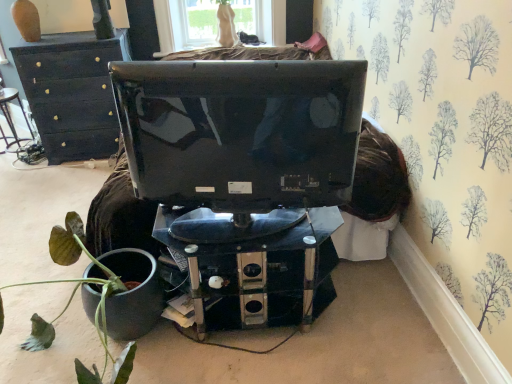
What do you see at coordinates (256, 265) in the screenshot?
I see `metallic black computer desk at center` at bounding box center [256, 265].

Describe the element at coordinates (11, 119) in the screenshot. This screenshot has width=512, height=384. I see `metallic silver chair at left` at that location.

I want to click on green matte plant pot at lower left, so click(x=89, y=287).

This screenshot has width=512, height=384. In order to click on black wood dresser at upper left in this screenshot , I will do `click(72, 92)`.

At what (x,y) coordinates should I click in order to perform the action: click on glossy black monitor at center. Please return your answer as a coordinate pair (x, y). Looking at the image, I should click on (241, 132).

Is glossy black monitor at center outside of transparent glass window at upper center?

That's correct, glossy black monitor at center is outside of transparent glass window at upper center.

From the image's perspective, does glossy black monitor at center appear higher than transparent glass window at upper center?

No, from the image's perspective, glossy black monitor at center is not over transparent glass window at upper center.

You are a GUI agent. You are given a task and a screenshot of the screen. Output one action in this format:
    pyautogui.click(x=<x>, y=<y>)
    Task: Click on the computer monitor located below the transparent glass window at upper center (from the image's perspective)
    
    Given the screenshot: What is the action you would take?
    pyautogui.click(x=241, y=132)

Could you tell me if glossy black monitor at center is turned towards transparent glass window at upper center?

Yes, glossy black monitor at center is oriented towards transparent glass window at upper center.

From a real-world perspective, who is located higher, metallic silver chair at left or black wood dresser at upper left?

black wood dresser at upper left is physically above.

You are a GUI agent. You are given a task and a screenshot of the screen. Output one action in this format:
    pyautogui.click(x=<x>, y=<y>)
    Task: Click on the furniture that appears above the metallic silver chair at left (from the image's perspective)
    The width and height of the screenshot is (512, 384).
    Given the screenshot: What is the action you would take?
    pyautogui.click(x=72, y=92)

Which object is wider, metallic silver chair at left or black wood dresser at upper left?

black wood dresser at upper left is wider.

Does metallic silver chair at left have a smaller size compared to black wood dresser at upper left?

Indeed, metallic silver chair at left has a smaller size compared to black wood dresser at upper left.

Considering the relative sizes of black wood dresser at upper left and transparent glass window at upper center in the image provided, is black wood dresser at upper left taller than transparent glass window at upper center?

Indeed, black wood dresser at upper left has a greater height compared to transparent glass window at upper center.

Which of these two, black wood dresser at upper left or transparent glass window at upper center, is wider?

Wider between the two is black wood dresser at upper left.

How different are the orientations of black wood dresser at upper left and transparent glass window at upper center in degrees?

The angle between the facing direction of black wood dresser at upper left and the facing direction of transparent glass window at upper center is 0.709 degrees.

Visually, is black wood dresser at upper left positioned to the left or to the right of transparent glass window at upper center?

black wood dresser at upper left is positioned on transparent glass window at upper center's left side.

Does green matte plant pot at lower left come behind metallic black computer desk at center?

No, green matte plant pot at lower left is in front of metallic black computer desk at center.

Based on the photo, from the image's perspective, would you say green matte plant pot at lower left is positioned over metallic black computer desk at center?

No, from the image's perspective, green matte plant pot at lower left is not over metallic black computer desk at center.

Looking at this image, what's the angular difference between green matte plant pot at lower left and metallic black computer desk at center's facing directions?

They differ by 1.31e-05 degrees in their facing directions.

Is point (149, 273) closer or farther from the camera than point (218, 222)?

Clearly, point (149, 273) is more distant from the camera than point (218, 222).

Considering the relative positions of metallic silver chair at left and metallic black computer desk at center in the image provided, is metallic silver chair at left to the left or to the right of metallic black computer desk at center?

metallic silver chair at left is to the left of metallic black computer desk at center.

Where is `computer desk on the right of metallic silver chair at left`? The height and width of the screenshot is (384, 512). computer desk on the right of metallic silver chair at left is located at coordinates (256, 265).

Is metallic silver chair at left taller than metallic black computer desk at center?

Yes.

Does transparent glass window at upper center contain glossy black monitor at center?

No, glossy black monitor at center is not inside transparent glass window at upper center.

Relative to glossy black monitor at center, is transparent glass window at upper center in front or behind?

transparent glass window at upper center is behind glossy black monitor at center.

Considering the relative sizes of transparent glass window at upper center and glossy black monitor at center in the image provided, is transparent glass window at upper center thinner than glossy black monitor at center?

No, transparent glass window at upper center is not thinner than glossy black monitor at center.

Between transparent glass window at upper center and glossy black monitor at center, which one has larger size?

glossy black monitor at center is bigger.

Is green matte plant pot at lower left oriented towards black wood dresser at upper left?

No, green matte plant pot at lower left does not turn towards black wood dresser at upper left.

From a real-world perspective, which object stands above the other?

black wood dresser at upper left, from a real-world perspective.

How many degrees apart are the facing directions of green matte plant pot at lower left and black wood dresser at upper left?

They differ by 4.02e-05 degrees in their facing directions.

From their relative heights in the image, would you say green matte plant pot at lower left is taller or shorter than black wood dresser at upper left?

Clearly, green matte plant pot at lower left is shorter compared to black wood dresser at upper left.

What are the coordinates of `computer monitor that is on the right side of transparent glass window at upper center` in the screenshot? It's located at (241, 132).

Locate an element on the screen. chair below the black wood dresser at upper left (from a real-world perspective) is located at coordinates (11, 119).

Estimate the real-world distances between objects in this image. Which object is closer to glossy black monitor at center, metallic black computer desk at center or transparent glass window at upper center?

Among the two, metallic black computer desk at center is located nearer to glossy black monitor at center.

From the image, which object appears to be farther from metallic silver chair at left, metallic black computer desk at center or transparent glass window at upper center?

metallic black computer desk at center is positioned further to the anchor metallic silver chair at left.

From the image, which object appears to be farther from metallic black computer desk at center, metallic silver chair at left or black wood dresser at upper left?

The object further to metallic black computer desk at center is metallic silver chair at left.

Estimate the real-world distances between objects in this image. Which object is closer to transparent glass window at upper center, metallic black computer desk at center or glossy black monitor at center?

glossy black monitor at center is closer to transparent glass window at upper center.

From the image, which object appears to be farther from glossy black monitor at center, black wood dresser at upper left or metallic silver chair at left?

The object further to glossy black monitor at center is metallic silver chair at left.

Based on the photo, estimate the real-world distances between objects in this image. Which object is closer to green matte plant pot at lower left, transparent glass window at upper center or metallic silver chair at left?

Based on the image, metallic silver chair at left appears to be nearer to green matte plant pot at lower left.

Considering their positions, is green matte plant pot at lower left positioned further to transparent glass window at upper center than black wood dresser at upper left?

green matte plant pot at lower left lies further to transparent glass window at upper center than the other object.

From the image, which object appears to be farther from black wood dresser at upper left, metallic silver chair at left or green matte plant pot at lower left?

green matte plant pot at lower left is further to black wood dresser at upper left.

Locate an element on the screen. computer desk between green matte plant pot at lower left and transparent glass window at upper center along the z-axis is located at coordinates (256, 265).

The height and width of the screenshot is (384, 512). I want to click on window between green matte plant pot at lower left and metallic silver chair at left in the front-back direction, so click(x=189, y=25).

At what (x,y) coordinates should I click in order to perform the action: click on computer monitor between green matte plant pot at lower left and transparent glass window at upper center in the front-back direction. Please return your answer as a coordinate pair (x, y). Image resolution: width=512 pixels, height=384 pixels. Looking at the image, I should click on (241, 132).

Find the location of `computer desk positioned between glossy black monitor at center and transparent glass window at upper center from near to far`. computer desk positioned between glossy black monitor at center and transparent glass window at upper center from near to far is located at coordinates (256, 265).